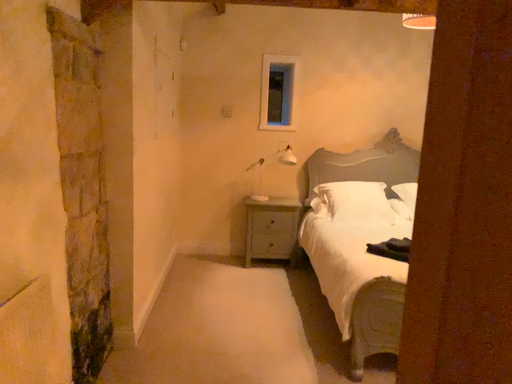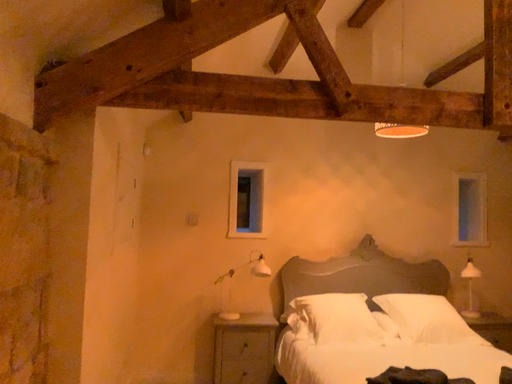
Question: Which way did the camera rotate in the video?

Choices:
 (A) rotated downward
 (B) rotated upward

Answer: (B)